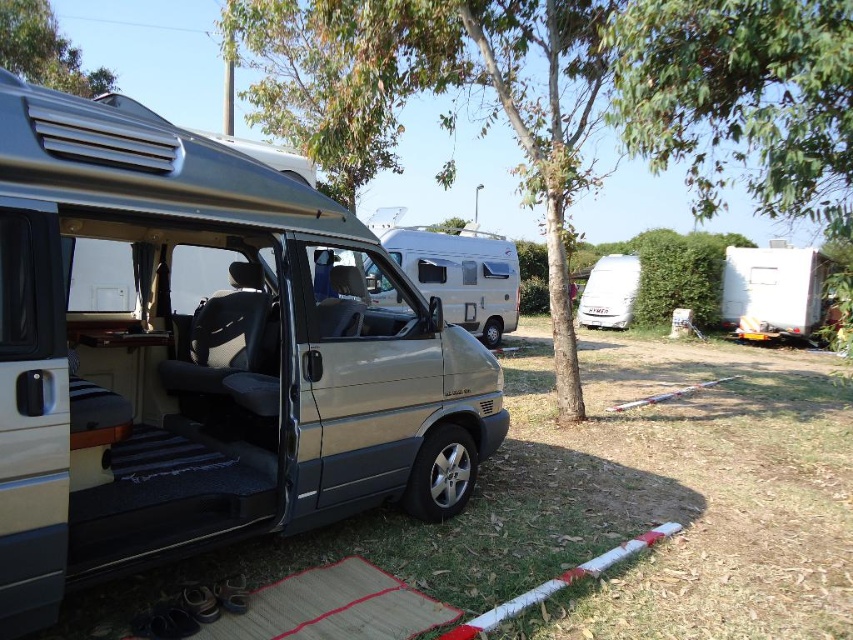
Which is more to the left, silver metallic van at center or white matte camper at right?

Positioned to the left is silver metallic van at center.

Can you confirm if silver metallic van at center is taller than white matte camper at right?

Incorrect, silver metallic van at center's height is not larger of white matte camper at right's.

Measure the distance between silver metallic van at center and camera.

silver metallic van at center is 12.42 meters from camera.

You are a GUI agent. You are given a task and a screenshot of the screen. Output one action in this format:
    pyautogui.click(x=<x>, y=<y>)
    Task: Click on the silver metallic van at center
    This screenshot has width=853, height=640.
    Given the screenshot: What is the action you would take?
    pyautogui.click(x=462, y=275)

Does metallic silver minivan at center have a smaller size compared to white matte camper at right?

Actually, metallic silver minivan at center might be larger than white matte camper at right.

Where is `metallic silver minivan at center`? The image size is (853, 640). metallic silver minivan at center is located at coordinates (202, 355).

The height and width of the screenshot is (640, 853). In order to click on metallic silver minivan at center in this screenshot , I will do `click(202, 355)`.

From the picture: Can you confirm if metallic silver minivan at center is wider than white matte van at center?

Yes.

Measure the distance between point (335, 356) and camera.

11.89 feet

Where is `metallic silver minivan at center`? metallic silver minivan at center is located at coordinates (202, 355).